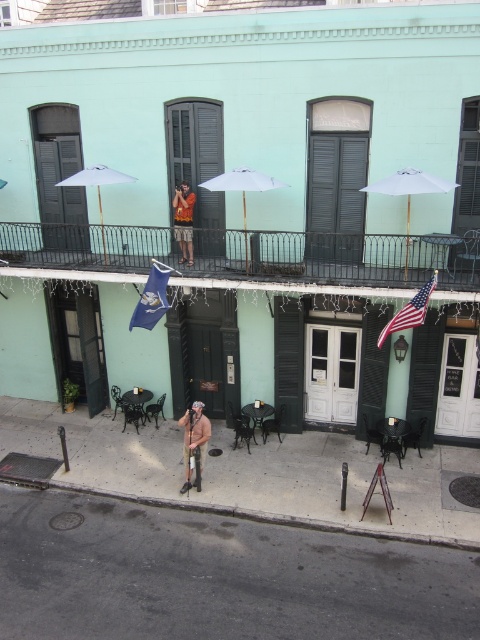
How much distance is there between smooth concrete sidewalk at lower center and blue fabric flag at center?

smooth concrete sidewalk at lower center and blue fabric flag at center are 3.76 meters apart from each other.

You are a GUI agent. You are given a task and a screenshot of the screen. Output one action in this format:
    pyautogui.click(x=<x>, y=<y>)
    Task: Click on the smooth concrete sidewalk at lower center
    The image size is (480, 640).
    Given the screenshot: What is the action you would take?
    pyautogui.click(x=251, y=474)

Identify the location of smooth concrete sidewalk at lower center. (251, 474).

Is gray asphalt at lower left closer to camera compared to dark gray wooden shutter at left?

Yes, gray asphalt at lower left is in front of dark gray wooden shutter at left.

The height and width of the screenshot is (640, 480). Identify the location of gray asphalt at lower left. (216, 577).

Describe the element at coordinates (216, 577) in the screenshot. Image resolution: width=480 pixels, height=640 pixels. I see `gray asphalt at lower left` at that location.

Locate an element on the screen. This screenshot has height=640, width=480. gray asphalt at lower left is located at coordinates (216, 577).

Does point (249, 522) come farther from viewer compared to point (468, 113)?

No, it is in front of (468, 113).

Is point (8, 609) positioned before point (472, 266)?

Yes, point (8, 609) is in front of point (472, 266).

In order to click on gray asphalt at lower left in this screenshot , I will do `click(216, 577)`.